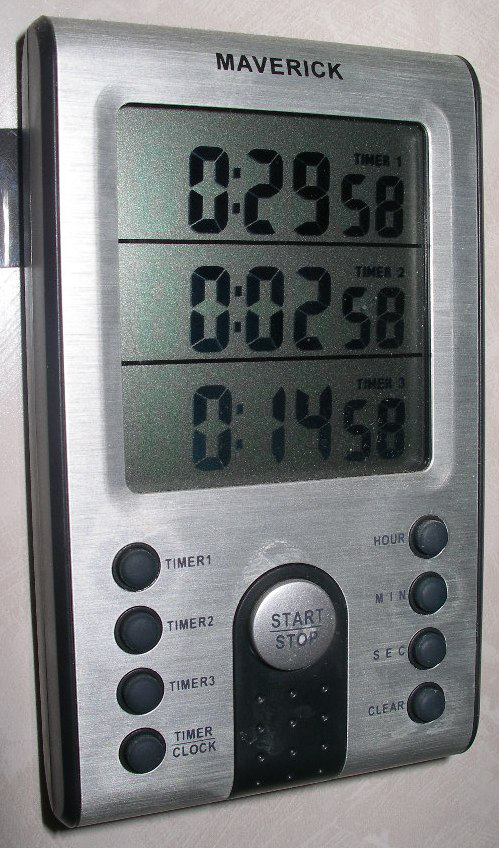
This screenshot has height=848, width=499. Find the location of `display`. display is located at coordinates (267, 303).